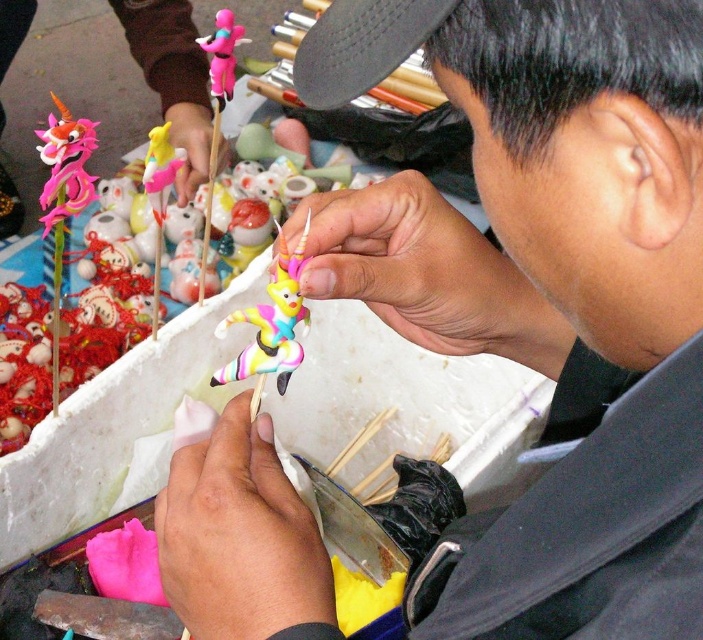
You are a visitor standing at the edge of the workspace and want to pick up the pastel plastic toy at center. Is it within your reach?

The pastel plastic toy at center is 18.10 inches away from viewer, so yes, it is within reach.

What are the coordinates of the black matte baseball cap at upper center?

The black matte baseball cap at upper center is located at coordinates point (x=361, y=45).

Looking at this image, you are a craftsperson working on the pastel plastic toy at center and the pink matte figurine at upper left. Which object is closer to you?

The pastel plastic toy at center is closer to you because it is in front of the pink matte figurine at upper left.